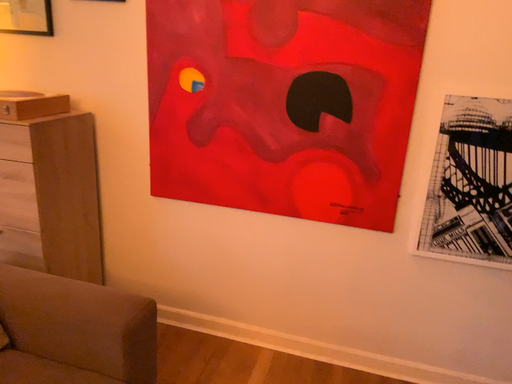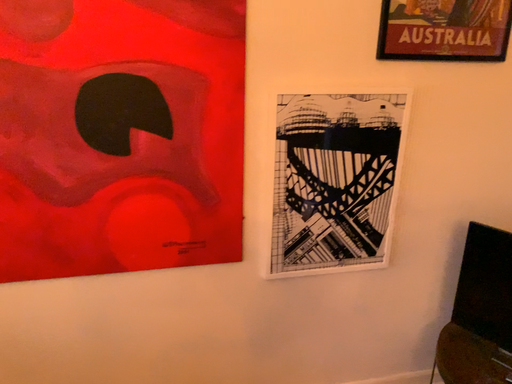
Question: Which way did the camera rotate in the video?

Choices:
 (A) rotated right
 (B) rotated left

Answer: (A)